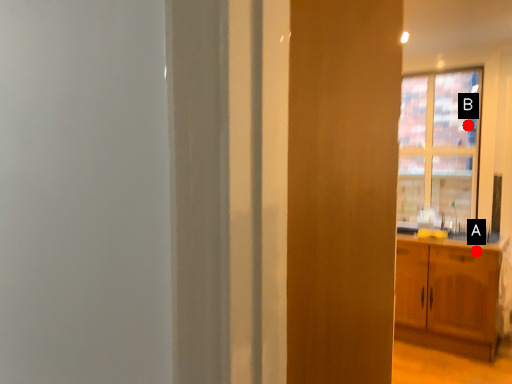
Question: Two points are circled on the image, labeled by A and B beside each circle. Among these points, which one is farthest from the camera?

Choices:
 (A) A is further
 (B) B is further

Answer: (B)